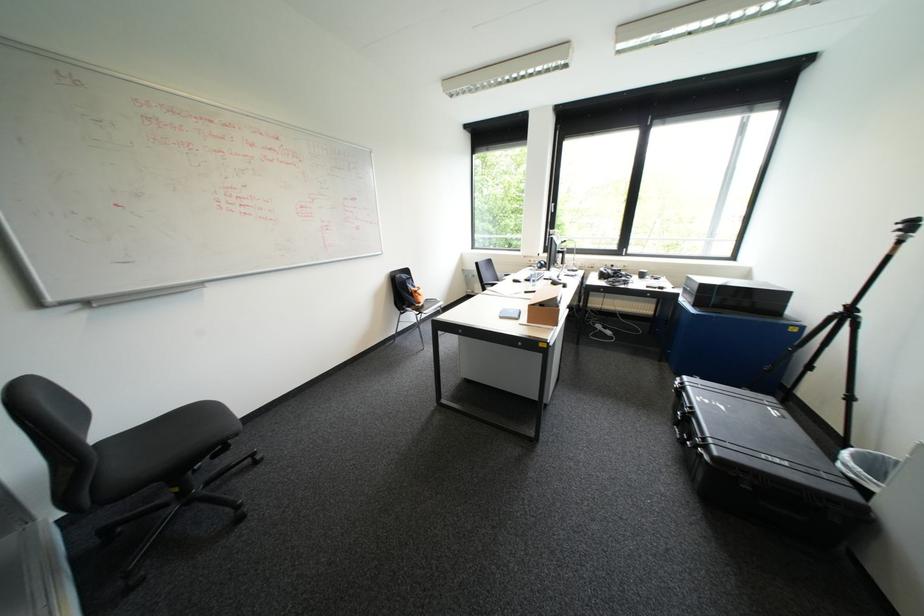
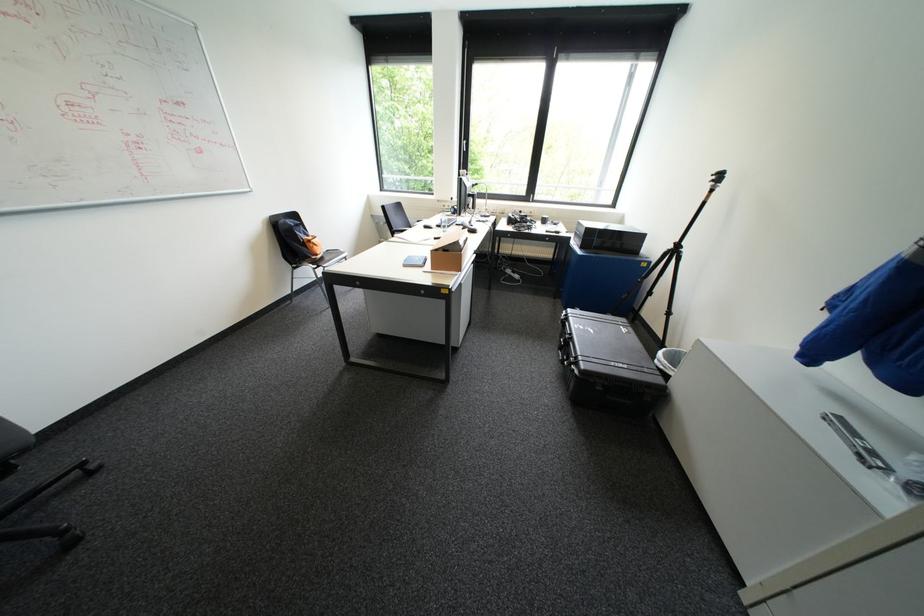
In the second image, find the point that corresponds to point 858,493 in the first image.

(666, 379)